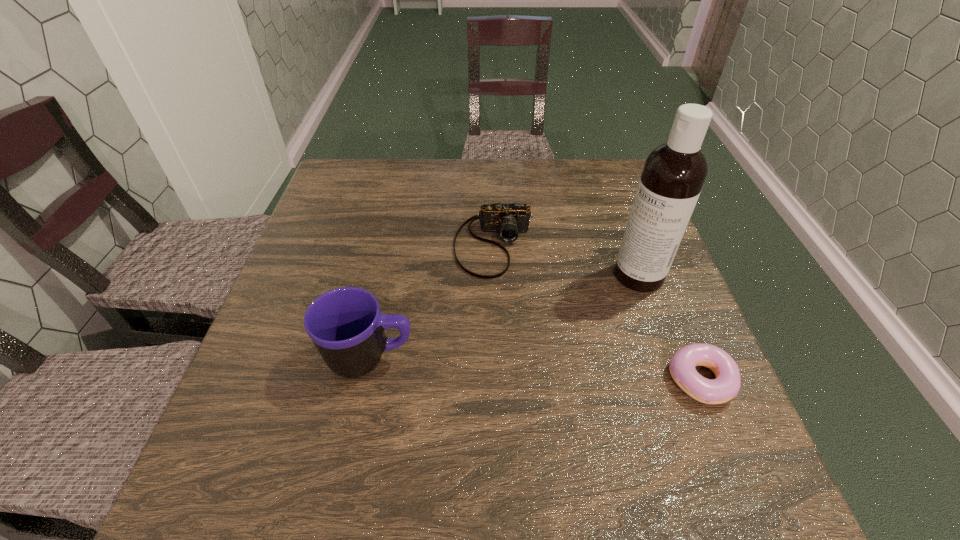
I want to click on free spot located 0.100m on the label side of the tallest object, so click(592, 307).

Find the location of a particular element. Image resolution: width=960 pixels, height=540 pixels. free region located 0.380m on the front-facing side of the second object from left to right is located at coordinates (490, 438).

The width and height of the screenshot is (960, 540). What are the coordinates of `free space located on the front-facing side of the second object from left to right` in the screenshot? It's located at (491, 396).

Identify the location of vacant space situated 0.390m on the front-facing side of the second object from left to right. (490, 444).

Find the location of a particular element. Image resolution: width=960 pixels, height=540 pixels. object that is at the near edge is located at coordinates (682, 365).

You are a GUI agent. You are given a task and a screenshot of the screen. Output one action in this format:
    pyautogui.click(x=<x>, y=<y>)
    Task: Click on the object that is at the left edge
    
    Given the screenshot: What is the action you would take?
    pyautogui.click(x=345, y=324)

This screenshot has width=960, height=540. In order to click on doughnut that is positioned at the right edge in this screenshot , I will do `click(682, 365)`.

In order to click on dishwasher detergent that is at the right edge in this screenshot , I will do `click(674, 173)`.

Find the location of a particular element. The image size is (960, 540). object that is at the near right corner is located at coordinates (682, 365).

This screenshot has width=960, height=540. Find the location of `blank space at the far edge of the desktop`. blank space at the far edge of the desktop is located at coordinates (567, 187).